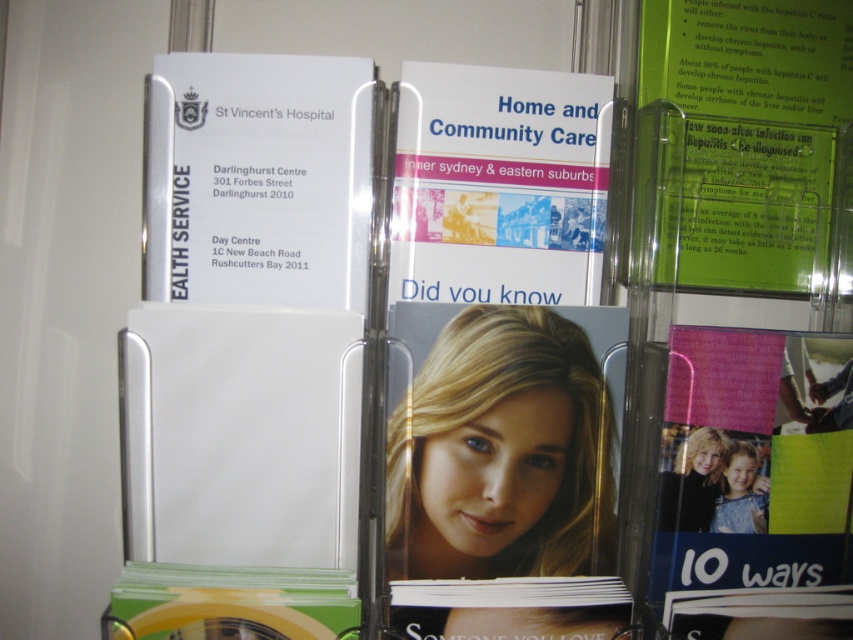
Does white paper at center come behind green plastic card at upper right?

That is False.

The width and height of the screenshot is (853, 640). I want to click on white paper at center, so click(x=498, y=184).

Can you confirm if pink glossy magazine at lower right is positioned to the left of green plastic card at upper right?

Yes, pink glossy magazine at lower right is to the left of green plastic card at upper right.

Does pink glossy magazine at lower right appear on the right side of green plastic card at upper right?

No, pink glossy magazine at lower right is not to the right of green plastic card at upper right.

Which is behind, point (746, 460) or point (781, 289)?

The point (781, 289) is more distant.

The height and width of the screenshot is (640, 853). Find the location of `pink glossy magazine at lower right`. pink glossy magazine at lower right is located at coordinates (751, 492).

Is the position of white paper at upper left more distant than that of green glossy magazine at lower left?

Yes, it is.

Is point (254, 172) in front of point (235, 620)?

No, it is not.

Identify the location of white paper at upper left. (257, 179).